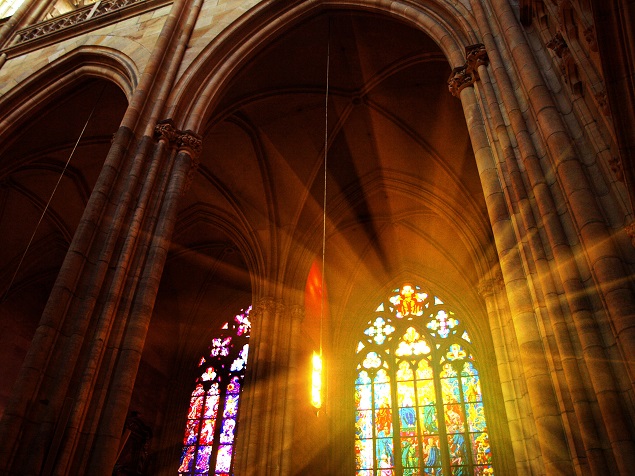
You are a GUI agent. You are given a task and a screenshot of the screen. Output one action in this format:
    pyautogui.click(x=<x>, y=<y>)
    Task: Click on the orange stained glass panel on left window
    Image resolution: width=635 pixels, height=476 pixels.
    Given the screenshot: What is the action you would take?
    pyautogui.click(x=188, y=460)